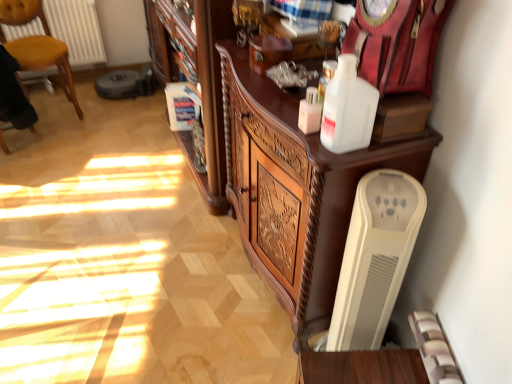
Where is `free space in front of brown carved wood dresser at center`? free space in front of brown carved wood dresser at center is located at coordinates (145, 260).